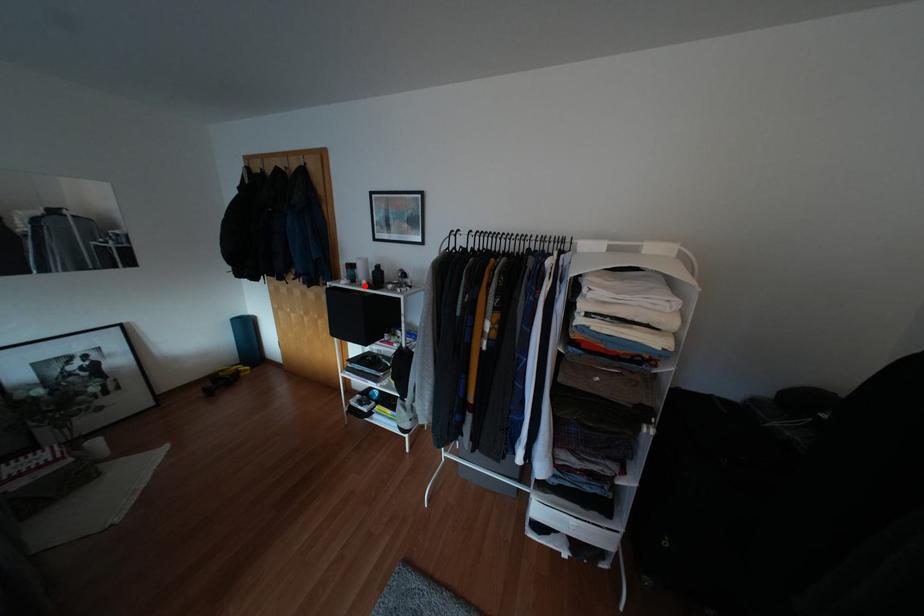
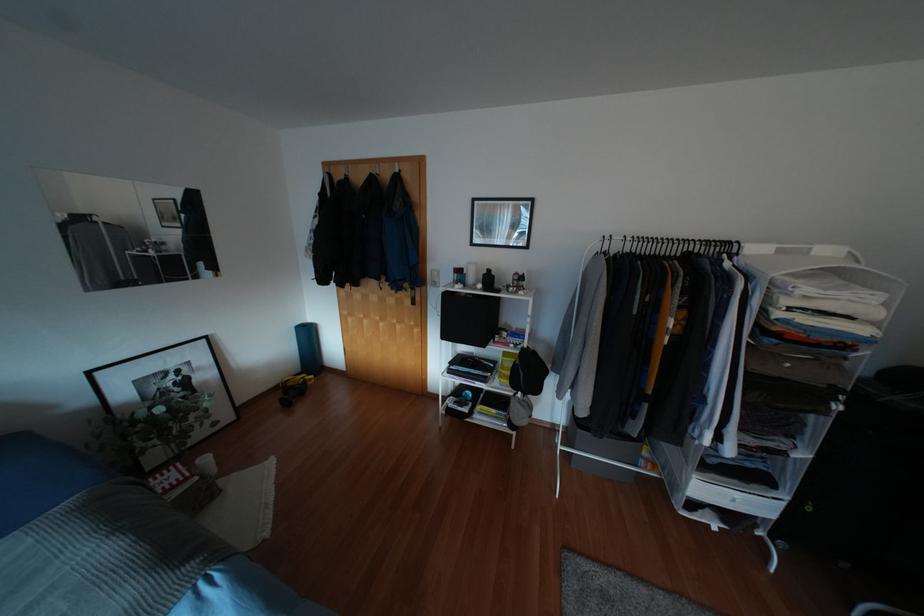
Locate, in the second image, the point that corresponds to the highlighted location in the first image.

(483, 289)